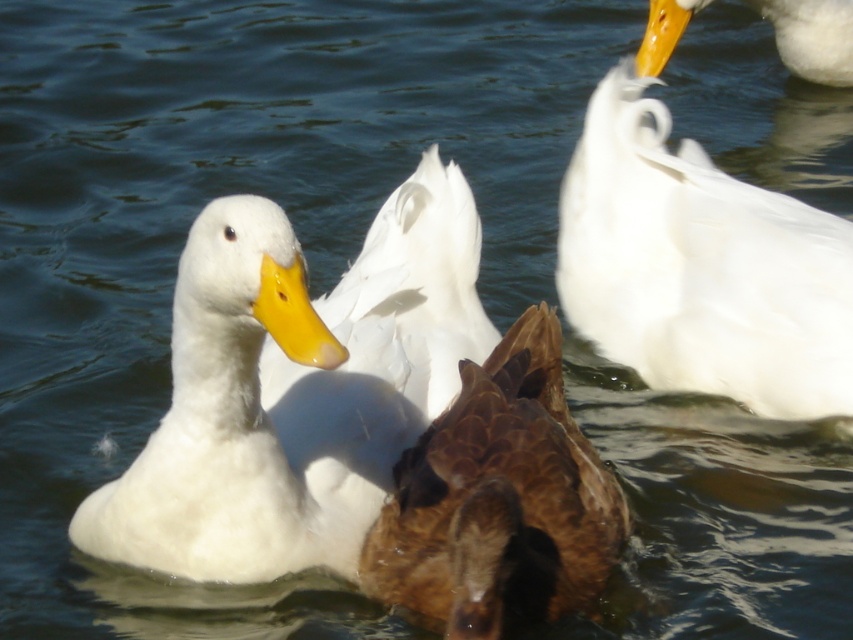
Question: Which object is farther from the camera taking this photo?

Choices:
 (A) white matte duck at upper right
 (B) white matte goose at upper right
 (C) white fluffy duck at center

Answer: (A)

Question: Does white fluffy duck at center have a lesser width compared to brown feathered duck at center?

Choices:
 (A) yes
 (B) no

Answer: (B)

Question: Is the position of white matte goose at upper right less distant than that of white matte duck at upper right?

Choices:
 (A) yes
 (B) no

Answer: (A)

Question: Which point is closer to the camera?

Choices:
 (A) (711, 253)
 (B) (604, 515)
 (C) (659, 58)
 (D) (294, 314)

Answer: (D)

Question: Which point is farther from the camera taking this photo?

Choices:
 (A) pos(509,616)
 (B) pos(395,244)
 (C) pos(788,380)
 (D) pos(805,51)

Answer: (D)

Question: Does brown feathered duck at center have a lesser width compared to white matte duck at upper right?

Choices:
 (A) yes
 (B) no

Answer: (B)